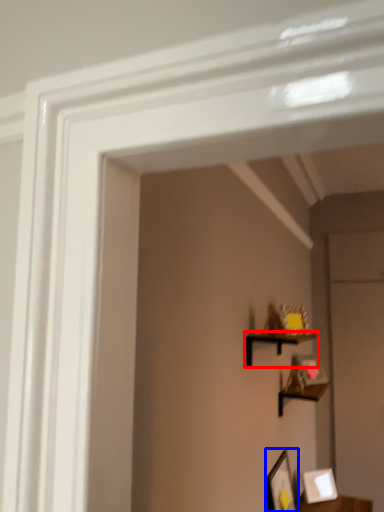
Question: Which of the following is the closest to the observer, shelf (highlighted by a red box) or picture frame (highlighted by a blue box)?

Choices:
 (A) shelf
 (B) picture frame

Answer: (A)